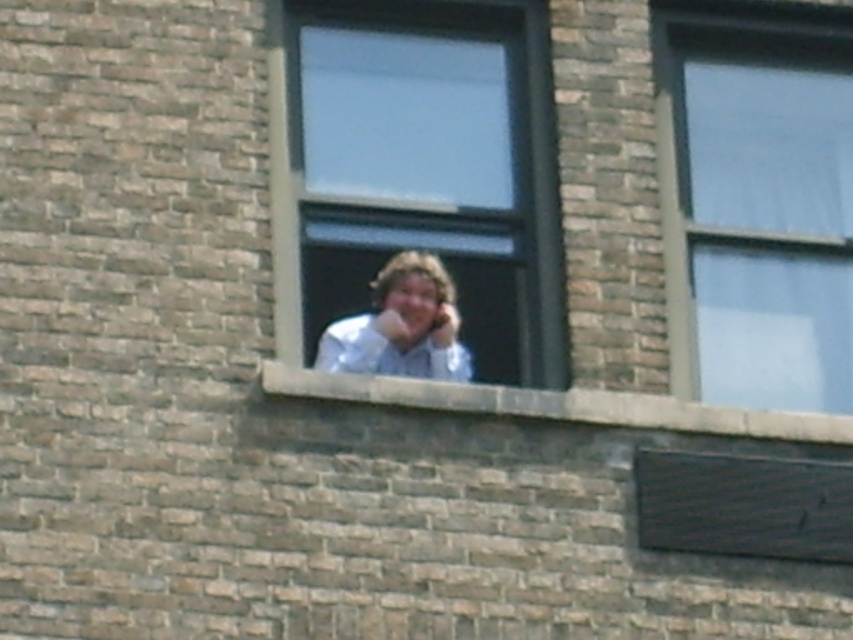
Question: Which of the following is the farthest from the observer?

Choices:
 (A) (465, 26)
 (B) (386, 284)
 (C) (851, 385)

Answer: (A)

Question: Is clear glass window at center further to the viewer compared to white shirt at center?

Choices:
 (A) yes
 (B) no

Answer: (B)

Question: Does transparent glass window at upper right appear on the left side of brown brick ledge at center?

Choices:
 (A) no
 (B) yes

Answer: (A)

Question: Which object appears farthest from the camera in this image?

Choices:
 (A) white shirt at center
 (B) clear glass window at center
 (C) brown brick ledge at center

Answer: (A)

Question: Based on their relative distances, which object is nearer to the transparent glass window at upper right?

Choices:
 (A) clear glass window at center
 (B) brown brick ledge at center

Answer: (A)

Question: Does transparent glass window at upper right appear on the right side of brown brick ledge at center?

Choices:
 (A) yes
 (B) no

Answer: (A)